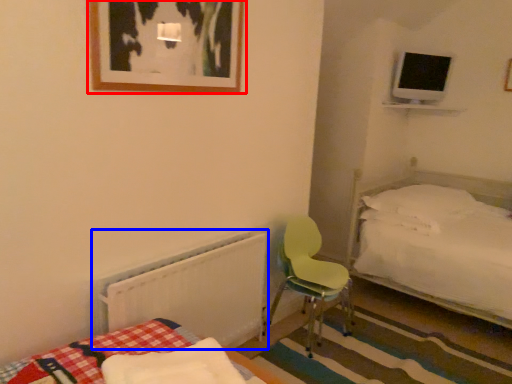
Question: Which of the following is the closest to the observer, picture frame (highlighted by a red box) or radiator (highlighted by a blue box)?

Choices:
 (A) picture frame
 (B) radiator

Answer: (A)